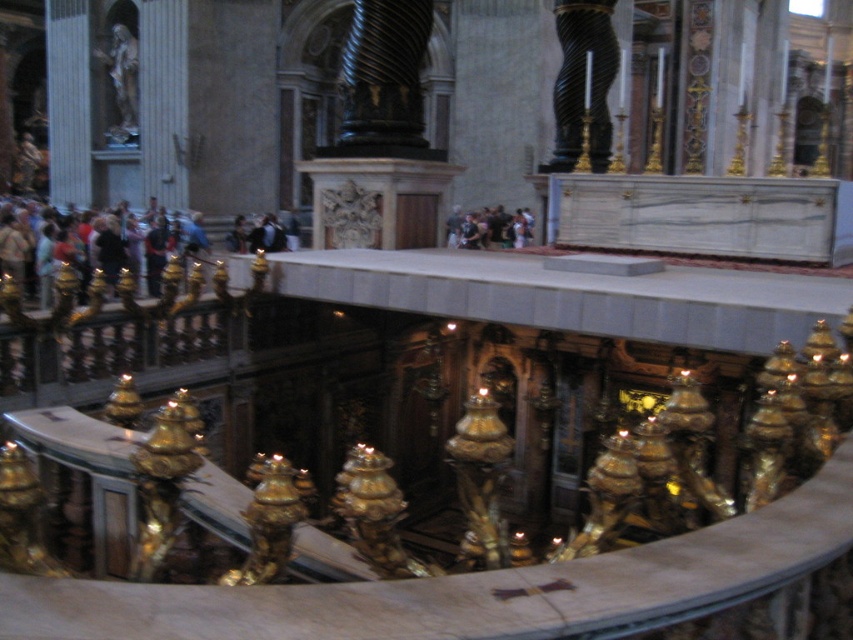
Between matte gold statue at center and dark clothing at center, which one has less height?

With less height is dark clothing at center.

Between point (491, 228) and point (283, 250), which one is positioned behind?

Positioned behind is point (491, 228).

Where is `matte gold statue at center`? The image size is (853, 640). matte gold statue at center is located at coordinates (494, 228).

Which is below, matte black jacket at left or dark clothing at center?

Positioned lower is matte black jacket at left.

Does matte black jacket at left have a lesser width compared to dark clothing at center?

Incorrect, matte black jacket at left's width is not less than dark clothing at center's.

Who is more distant from viewer, (85, 225) or (236, 220)?

The point (236, 220) is more distant.

Identify the location of matte black jacket at left. The width and height of the screenshot is (853, 640). (77, 252).

Which is behind, point (44, 273) or point (502, 243)?

The point (502, 243) is behind.

Who is shorter, matte black jacket at left or matte gold statue at center?

With less height is matte gold statue at center.

You are a GUI agent. You are given a task and a screenshot of the screen. Output one action in this format:
    pyautogui.click(x=<x>, y=<y>)
    Task: Click on the matte black jacket at left
    
    Given the screenshot: What is the action you would take?
    pyautogui.click(x=77, y=252)

Locate an element on the screen. Image resolution: width=853 pixels, height=640 pixels. matte black jacket at left is located at coordinates (77, 252).